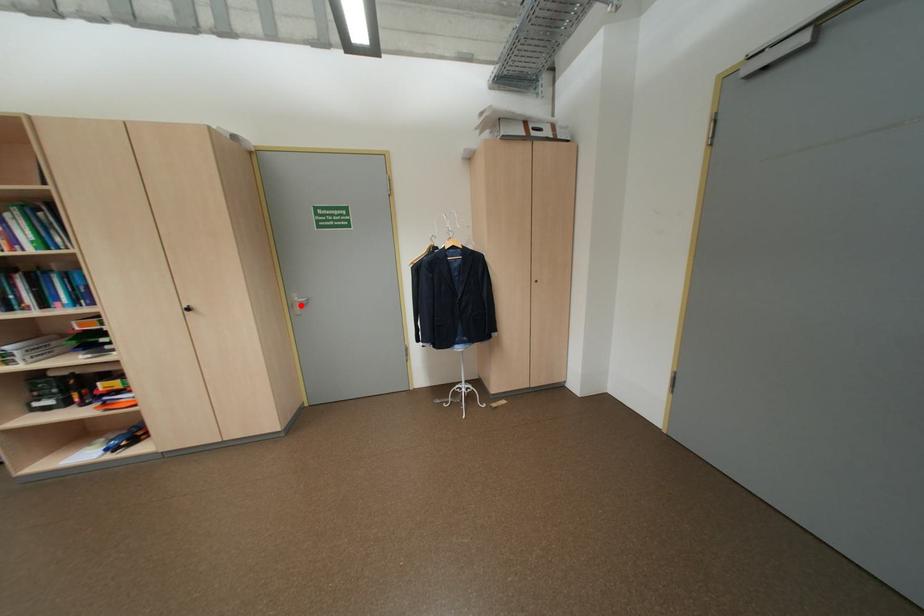
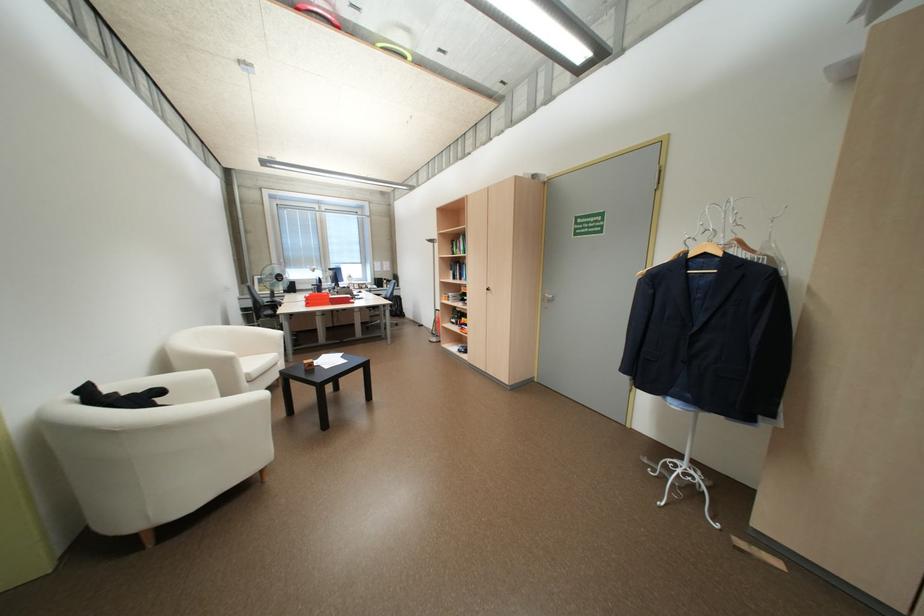
Find the pixel in the second image that matches the highlighted location in the first image.

(553, 299)